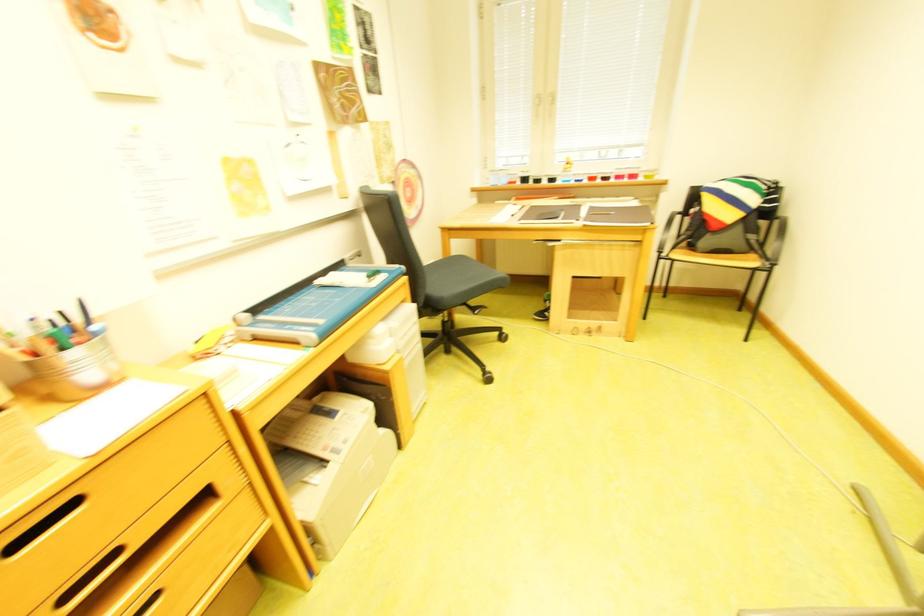
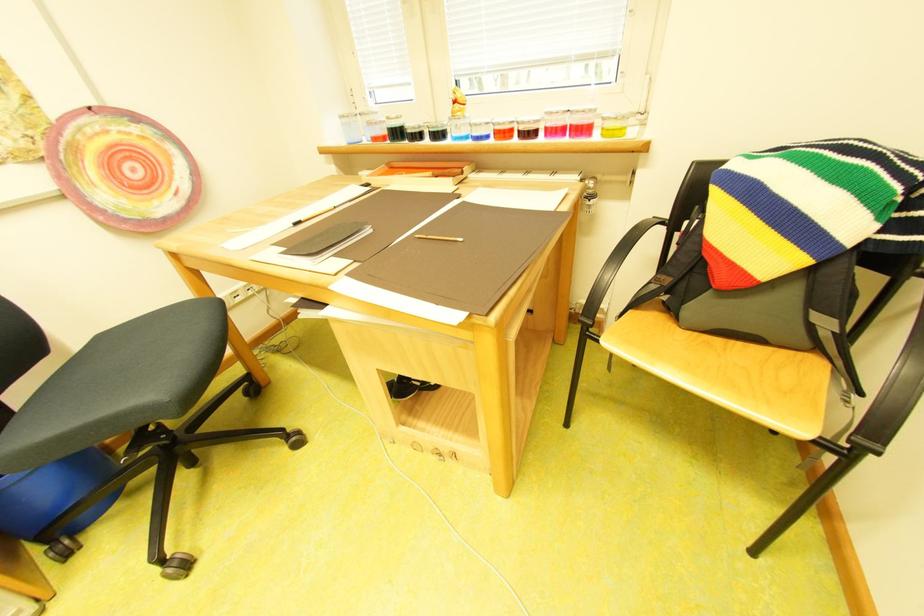
In the second image, find the point that corresponds to (575,171) in the first image.

(465, 115)